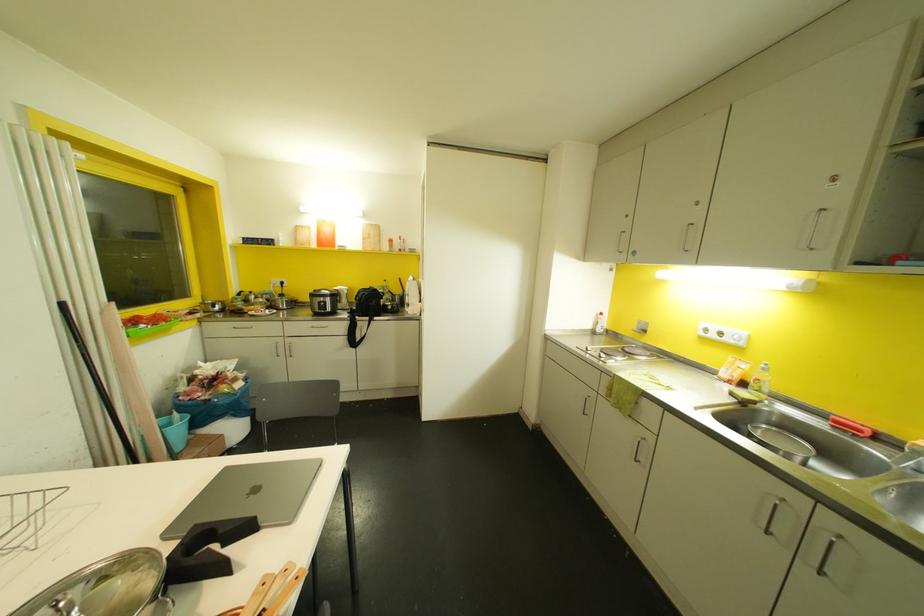
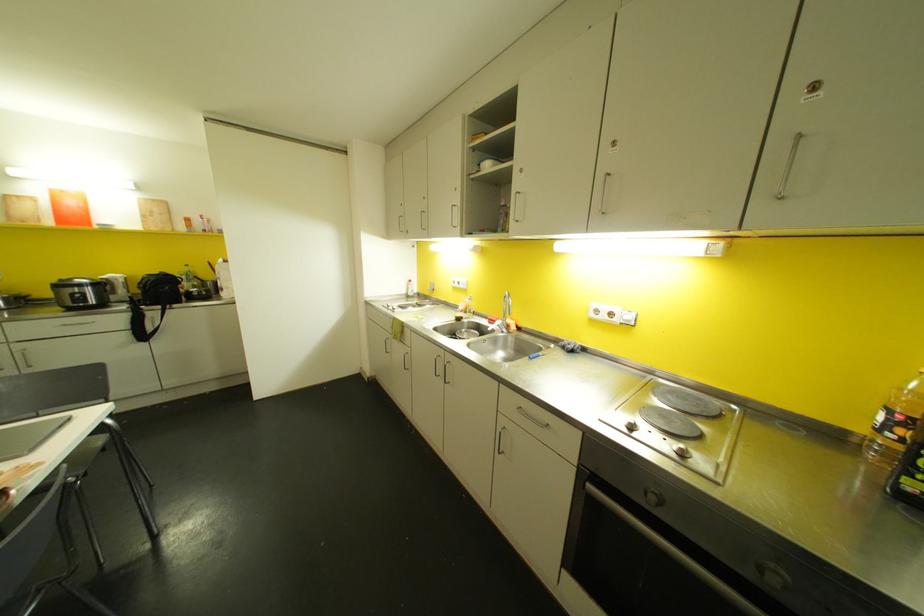
Question: The images are taken continuously from a first-person perspective. In which direction is your viewpoint rotating?

Choices:
 (A) Left
 (B) Right
 (C) Up
 (D) Down

Answer: (B)